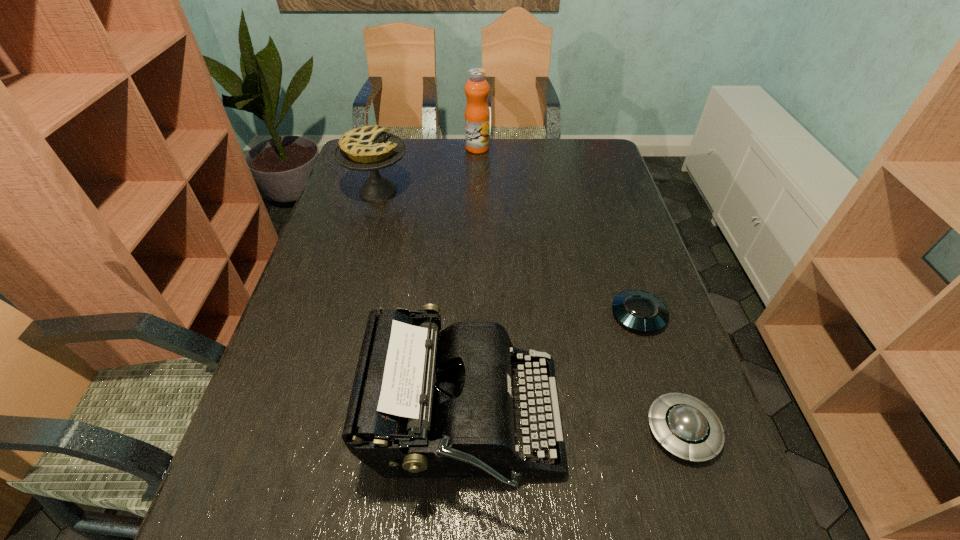
You are a GUI agent. You are given a task and a screenshot of the screen. Output one action in this format:
    pyautogui.click(x=<x>, y=<y>)
    Task: Click on the free spot between the shorter saucer and the taller saucer
    This screenshot has width=960, height=540.
    Given the screenshot: What is the action you would take?
    pyautogui.click(x=660, y=373)

Identify the location of vacant area that lies between the fourth nearest object and the second shortest object. The height and width of the screenshot is (540, 960). [530, 311].

Locate an element on the screen. The image size is (960, 540). empty location between the shorter saucer and the fruit juice is located at coordinates (558, 232).

Where is `object that ranks as the third closest to the tallest object`? object that ranks as the third closest to the tallest object is located at coordinates (424, 404).

The image size is (960, 540). What are the coordinates of `object that is the closest one to the typewriter` in the screenshot? It's located at coord(638,310).

You are a GUI agent. You are given a task and a screenshot of the screen. Output one action in this format:
    pyautogui.click(x=<x>, y=<y>)
    Task: Click on the vacant position in the image that satisfies the following two spatial constraints: 1. on the cut side of the pie; 2. on the right side of the shorter saucer
    
    Given the screenshot: What is the action you would take?
    pyautogui.click(x=345, y=315)

Where is `free location that satisfies the following two spatial constraints: 1. on the back side of the nearer saucer; 2. on the typing side of the typewriter`? The width and height of the screenshot is (960, 540). free location that satisfies the following two spatial constraints: 1. on the back side of the nearer saucer; 2. on the typing side of the typewriter is located at coordinates (679, 422).

I want to click on free space that satisfies the following two spatial constraints: 1. on the cut side of the taller saucer; 2. on the left side of the pie, so pyautogui.click(x=313, y=431).

You are a GUI agent. You are given a task and a screenshot of the screen. Output one action in this format:
    pyautogui.click(x=<x>, y=<y>)
    Task: Click on the vacant space that satisfies the following two spatial constraints: 1. on the typing side of the typewriter; 2. on the back side of the taller saucer
    
    Given the screenshot: What is the action you would take?
    pyautogui.click(x=465, y=431)

This screenshot has width=960, height=540. I want to click on vacant point that satisfies the following two spatial constraints: 1. on the front side of the farthest object; 2. on the typing side of the typewriter, so click(475, 422).